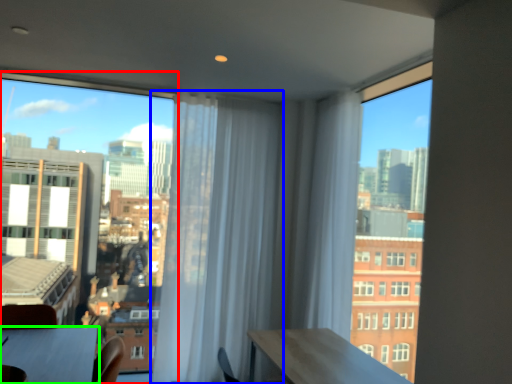
Question: Estimate the real-world distances between objects in this image. Which object is closer to window (highlighted by a red box), curtain (highlighted by a blue box) or table (highlighted by a green box)?

Choices:
 (A) curtain
 (B) table

Answer: (A)